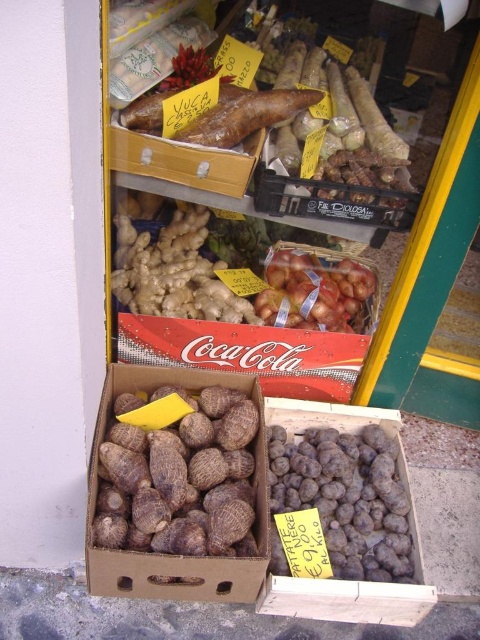
Who is taller, brown rough taro at center or shiny brown onions at center?

brown rough taro at center

From the picture: Is brown rough taro at center wider than shiny brown onions at center?

Indeed, brown rough taro at center has a greater width compared to shiny brown onions at center.

Who is more distant from viewer, (227, 497) or (332, 282)?

Point (332, 282)

You are a GUI agent. You are given a task and a screenshot of the screen. Output one action in this format:
    pyautogui.click(x=<x>, y=<y>)
    Task: Click on the brown rough taro at center
    
    Given the screenshot: What is the action you would take?
    pyautogui.click(x=179, y=476)

Does brown rough taro at lower center come in front of shiny brown onions at center?

Yes, it is in front of shiny brown onions at center.

Does point (288, 502) lie behind point (311, 253)?

No, (288, 502) is closer to viewer.

Where is `brown rough taro at lower center`? brown rough taro at lower center is located at coordinates (346, 497).

Is brown rough taro at center taller than brown rough taro at lower center?

Yes, brown rough taro at center is taller than brown rough taro at lower center.

Is point (132, 506) positioned before point (336, 570)?

Yes, it is.

What are the coordinates of `brown rough taro at center` in the screenshot? It's located at (179, 476).

Image resolution: width=480 pixels, height=640 pixels. Find the location of `brown rough taro at center`. brown rough taro at center is located at coordinates (179, 476).